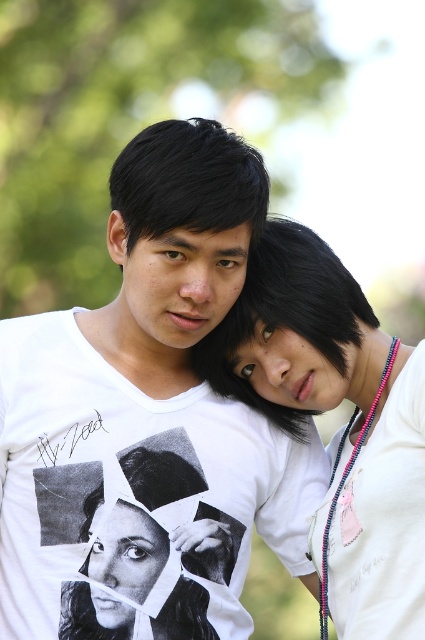
How much distance is there between white printed t-shirt at center and white matte necklace at upper right?

white printed t-shirt at center is 11.97 inches from white matte necklace at upper right.

This screenshot has height=640, width=425. Describe the element at coordinates (147, 420) in the screenshot. I see `white printed t-shirt at center` at that location.

You are a GUI agent. You are given a task and a screenshot of the screen. Output one action in this format:
    pyautogui.click(x=<x>, y=<y>)
    Task: Click on the white printed t-shirt at center
    The image size is (425, 640).
    Given the screenshot: What is the action you would take?
    pyautogui.click(x=147, y=420)